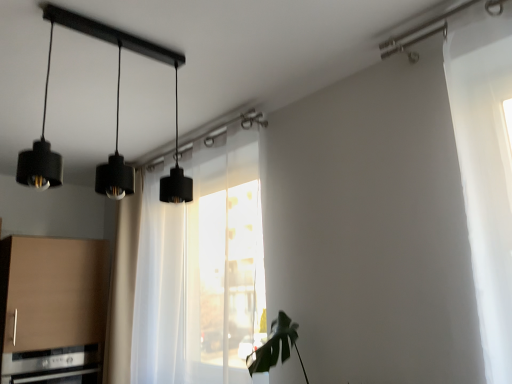
Question: Is transparent fabric at center not near matte brown cabinet at lower left?

Choices:
 (A) yes
 (B) no

Answer: (B)

Question: Is transparent fabric at center in front of matte brown cabinet at lower left?

Choices:
 (A) no
 (B) yes

Answer: (B)

Question: Is matte brown cabinet at lower left completely or partially inside transparent fabric at center?

Choices:
 (A) no
 (B) yes

Answer: (A)

Question: From a real-world perspective, is transparent fabric at center positioned under matte brown cabinet at lower left based on gravity?

Choices:
 (A) no
 (B) yes

Answer: (A)

Question: Considering the relative positions of transparent fabric at center and matte brown cabinet at lower left in the image provided, is transparent fabric at center behind matte brown cabinet at lower left?

Choices:
 (A) no
 (B) yes

Answer: (A)

Question: Considering the relative sizes of transparent fabric at center and matte brown cabinet at lower left in the image provided, is transparent fabric at center thinner than matte brown cabinet at lower left?

Choices:
 (A) no
 (B) yes

Answer: (B)

Question: From a real-world perspective, is satin silver oven at lower left under matte black pendant light at upper left?

Choices:
 (A) yes
 (B) no

Answer: (A)

Question: Is satin silver oven at lower left facing towards matte black pendant light at upper left?

Choices:
 (A) yes
 (B) no

Answer: (B)

Question: Is matte black pendant light at upper left at the back of satin silver oven at lower left?

Choices:
 (A) yes
 (B) no

Answer: (B)

Question: Does satin silver oven at lower left have a smaller size compared to matte black pendant light at upper left?

Choices:
 (A) no
 (B) yes

Answer: (A)

Question: Can you confirm if satin silver oven at lower left is thinner than matte black pendant light at upper left?

Choices:
 (A) no
 (B) yes

Answer: (A)

Question: Is satin silver oven at lower left in contact with matte black pendant light at upper left?

Choices:
 (A) yes
 (B) no

Answer: (B)

Question: Considering the relative sizes of matte black pendant light at upper left and satin silver oven at lower left in the image provided, is matte black pendant light at upper left taller than satin silver oven at lower left?

Choices:
 (A) yes
 (B) no

Answer: (A)